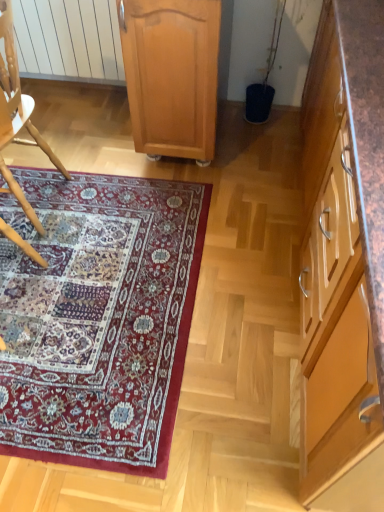
Locate an element on the screen. The height and width of the screenshot is (512, 384). vacant space to the left of light brown wood cabinet at center, which is the first cabinetry from left to right is located at coordinates (92, 131).